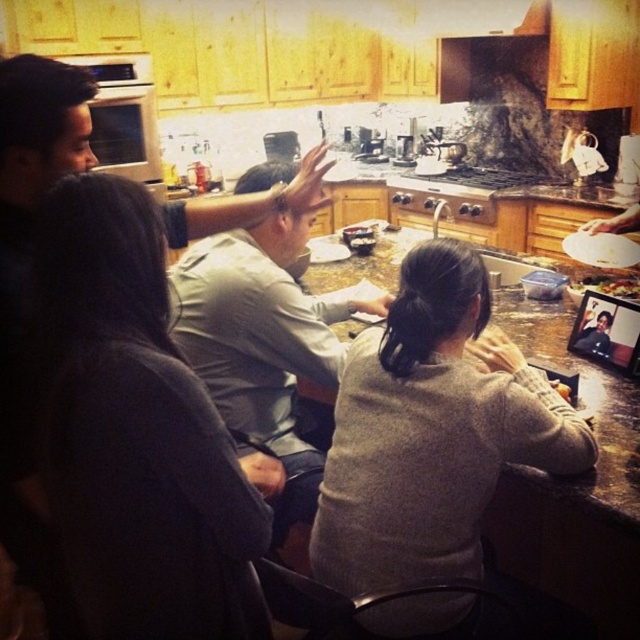
Is light gray shirt at center thinner than smooth white plate at lower right?

Incorrect, light gray shirt at center's width is not less than smooth white plate at lower right's.

Is point (179, 312) less distant than point (564, 387)?

No.

At what (x,y) coordinates should I click in order to perform the action: click on light gray shirt at center. Please return your answer as a coordinate pair (x, y). This screenshot has width=640, height=640. Looking at the image, I should click on (260, 342).

Is dark gray sweater at upper left taller than smooth white plate at lower right?

Indeed, dark gray sweater at upper left has a greater height compared to smooth white plate at lower right.

Between dark gray sweater at upper left and smooth white plate at lower right, which one is positioned lower?

dark gray sweater at upper left

Image resolution: width=640 pixels, height=640 pixels. I want to click on dark gray sweater at upper left, so click(124, 412).

Is light gray shirt at center positioned at the back of green leafy salad at center?

No, light gray shirt at center is in front of green leafy salad at center.

This screenshot has height=640, width=640. I want to click on light gray shirt at center, so click(x=260, y=342).